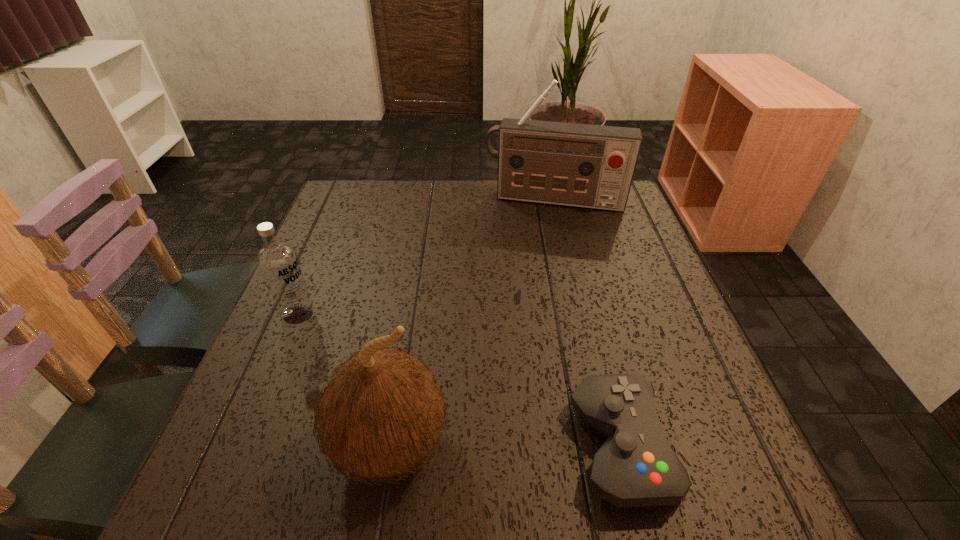
The height and width of the screenshot is (540, 960). Find the location of `vacant point located on the front panel of the radio receiver`. vacant point located on the front panel of the radio receiver is located at coordinates (531, 294).

Locate an element on the screen. free location located 0.270m on the front panel of the radio receiver is located at coordinates (534, 274).

Locate an element on the screen. This screenshot has width=960, height=540. vacant area located 0.110m on the front panel of the radio receiver is located at coordinates (540, 236).

You are a GUI agent. You are given a task and a screenshot of the screen. Output one action in this format:
    pyautogui.click(x=<x>, y=<y>)
    Task: Click on the object that is at the far edge
    The image size is (960, 540).
    Given the screenshot: What is the action you would take?
    pyautogui.click(x=591, y=166)

Identify the location of coconut situated at the near edge. (382, 413).

Locate an element on the screen. The height and width of the screenshot is (540, 960). control present at the near edge is located at coordinates (635, 467).

Locate an element on the screen. This screenshot has height=540, width=960. object at the left edge is located at coordinates (278, 262).

You are a GUI agent. You are given a task and a screenshot of the screen. Output one action in this format:
    pyautogui.click(x=<x>, y=<y>)
    Task: Click on the control situated at the right edge
    
    Given the screenshot: What is the action you would take?
    pyautogui.click(x=635, y=467)

In order to click on radio receiver present at the right edge in this screenshot , I will do `click(591, 166)`.

Locate an element on the screen. This screenshot has width=960, height=540. object situated at the far right corner is located at coordinates (591, 166).